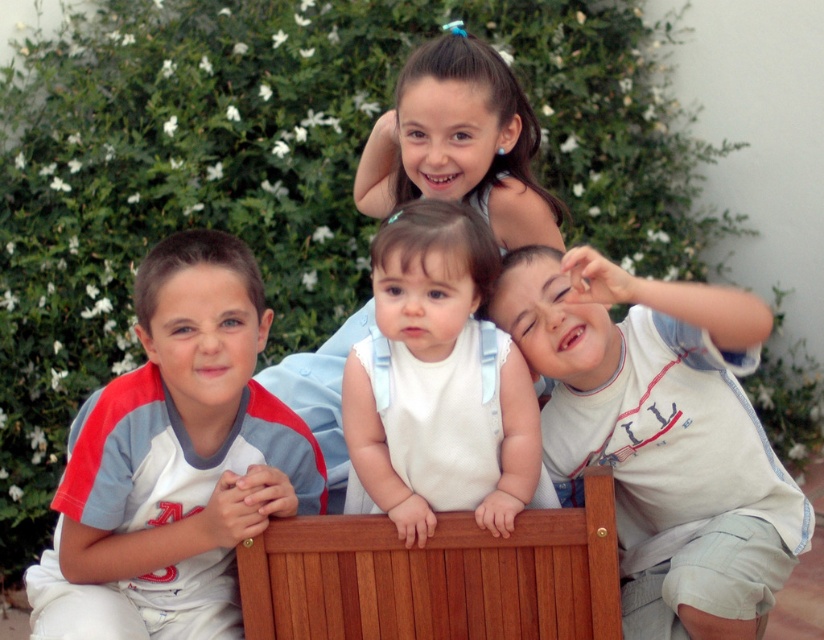
Where is `wooden bench at center`? This screenshot has height=640, width=824. wooden bench at center is located at coordinates (x=436, y=577).

In the scene shown: Is wooden bench at center in front of smooth blue dress at upper center?

Yes, it is.

Is point (452, 531) positioned in front of point (457, 192)?

Yes, it is.

In order to click on wooden bench at center in this screenshot , I will do `click(436, 577)`.

Locate an element on the screen. light blue fabric shirt at left is located at coordinates (176, 461).

Which is below, light blue fabric shirt at left or white cotton shirt at right?

Positioned lower is light blue fabric shirt at left.

Does point (228, 253) lie behind point (731, 456)?

No, it is in front of (731, 456).

Identify the location of light blue fabric shirt at left. This screenshot has width=824, height=640. (176, 461).

Is light blue fabric shirt at left shorter than white fabric dress at center?

No.

Between point (260, 305) and point (424, 256), which one is positioned behind?

Point (260, 305)

This screenshot has height=640, width=824. What are the coordinates of `light blue fabric shirt at left` in the screenshot? It's located at (176, 461).